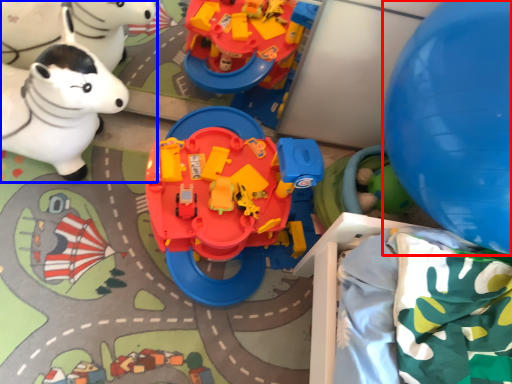
Question: Which point is further to the camera, balloon (highlighted by a red box) or toy (highlighted by a blue box)?

Choices:
 (A) balloon
 (B) toy

Answer: (B)